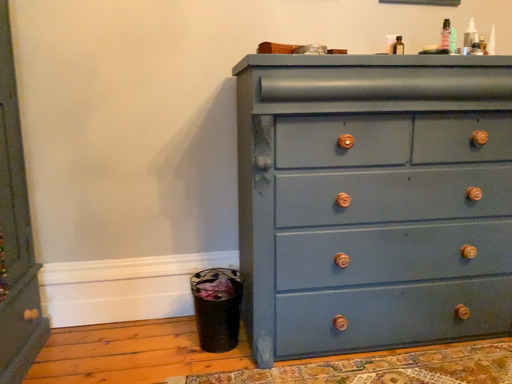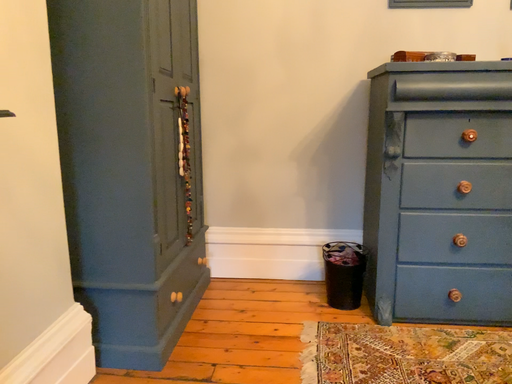
Question: Which way did the camera rotate in the video?

Choices:
 (A) rotated right
 (B) rotated left

Answer: (B)